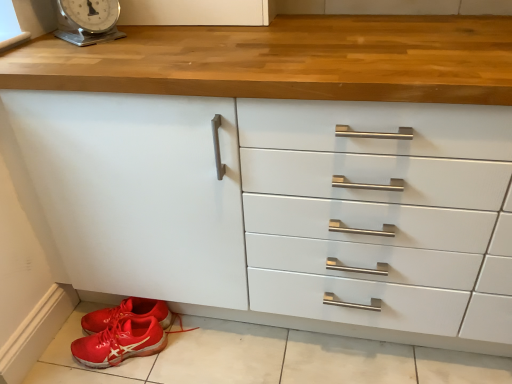
Identify the location of unoccupied region to the right of red rubber shoe at lower left. The image size is (512, 384). (191, 352).